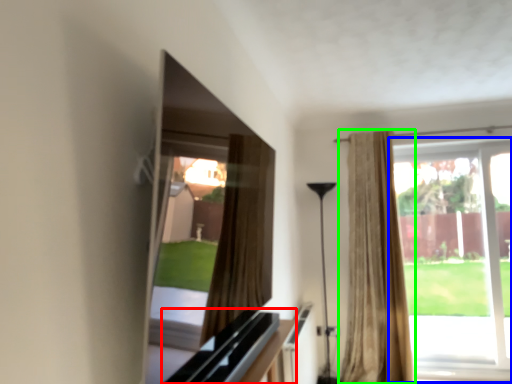
Question: Estimate the real-world distances between objects in this image. Which object is closer to dresser (highlighted by a red box), window (highlighted by a blue box) or curtain (highlighted by a green box)?

Choices:
 (A) window
 (B) curtain

Answer: (B)